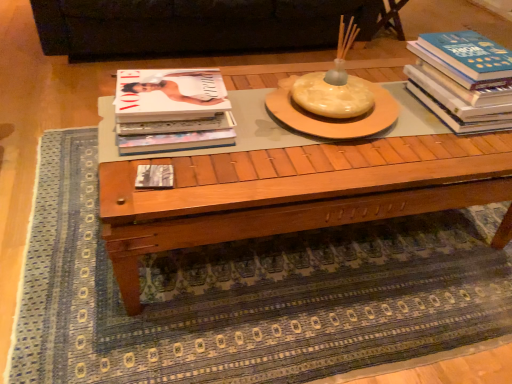
Where is `free space above blue hardcover book at right, which ranks as the third book in left-to-right order (from a real-world perspective)`? free space above blue hardcover book at right, which ranks as the third book in left-to-right order (from a real-world perspective) is located at coordinates coord(482,53).